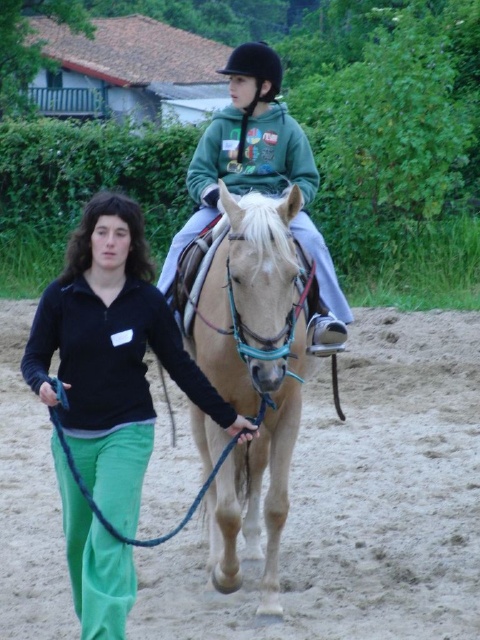
Does light brown leather horse at center appear on the left side of green fleece jacket at center?

Correct, you'll find light brown leather horse at center to the left of green fleece jacket at center.

Is light brown leather horse at center bigger than green fleece jacket at center?

Yes, light brown leather horse at center is bigger than green fleece jacket at center.

Locate an element on the screen. Image resolution: width=480 pixels, height=640 pixels. light brown leather horse at center is located at coordinates (253, 374).

Is brown sandy dirt field at center below light brown leather horse at center?

Correct, brown sandy dirt field at center is located below light brown leather horse at center.

Between brown sandy dirt field at center and light brown leather horse at center, which one has more height?

With more height is light brown leather horse at center.

Find the location of a particular element. The width and height of the screenshot is (480, 640). brown sandy dirt field at center is located at coordinates (359, 502).

In order to click on brown sandy dirt field at center in this screenshot , I will do `click(359, 502)`.

Is point (139, 580) positioned in front of point (231, 189)?

No, (139, 580) is further to viewer.

Is brown sandy dirt field at center shorter than green fleece jacket at center?

Indeed, brown sandy dirt field at center has a lesser height compared to green fleece jacket at center.

At what (x,y) coordinates should I click in order to perform the action: click on brown sandy dirt field at center. Please return your answer as a coordinate pair (x, y). Image resolution: width=480 pixels, height=640 pixels. Looking at the image, I should click on (x=359, y=502).

Locate an element on the screen. This screenshot has height=640, width=480. brown sandy dirt field at center is located at coordinates (359, 502).